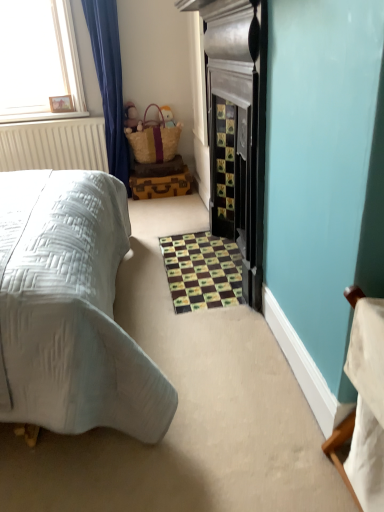
Question: Is woven straw basket at upper center turned away from matte brown wicker basket at upper center, arranged as the 2th toy when viewed from the left?

Choices:
 (A) no
 (B) yes

Answer: (B)

Question: Considering the relative positions of woven straw basket at upper center and matte brown wicker basket at upper center, arranged as the 2th toy when viewed from the left, in the image provided, is woven straw basket at upper center to the left of matte brown wicker basket at upper center, arranged as the 2th toy when viewed from the left, from the viewer's perspective?

Choices:
 (A) yes
 (B) no

Answer: (A)

Question: Could you tell me if woven straw basket at upper center is turned towards matte brown wicker basket at upper center, acting as the first toy starting from the right?

Choices:
 (A) yes
 (B) no

Answer: (B)

Question: Does woven straw basket at upper center have a lesser height compared to matte brown wicker basket at upper center, acting as the first toy starting from the right?

Choices:
 (A) yes
 (B) no

Answer: (B)

Question: From a real-world perspective, is woven straw basket at upper center located higher than matte brown wicker basket at upper center, acting as the first toy starting from the right?

Choices:
 (A) no
 (B) yes

Answer: (A)

Question: From the image's perspective, is woven straw basket at upper center located above or below brown mosaic tiles at center?

Choices:
 (A) above
 (B) below

Answer: (A)

Question: Is woven straw basket at upper center wider or thinner than brown mosaic tiles at center?

Choices:
 (A) wide
 (B) thin

Answer: (B)

Question: Considering the positions of woven straw basket at upper center and brown mosaic tiles at center in the image, is woven straw basket at upper center taller or shorter than brown mosaic tiles at center?

Choices:
 (A) short
 (B) tall

Answer: (B)

Question: Is point (140, 153) positioned closer to the camera than point (208, 260)?

Choices:
 (A) closer
 (B) farther

Answer: (B)

Question: Do you think woven straw basket at upper center is within matte brown plush toy at upper left, the second toy positioned from the right, or outside of it?

Choices:
 (A) outside
 (B) inside

Answer: (A)

Question: Relative to matte brown plush toy at upper left, which is counted as the 1th toy, starting from the left, is woven straw basket at upper center in front or behind?

Choices:
 (A) front
 (B) behind

Answer: (A)

Question: Is point (157, 111) closer or farther from the camera than point (129, 119)?

Choices:
 (A) farther
 (B) closer

Answer: (A)

Question: Visually, is woven straw basket at upper center positioned to the left or to the right of matte brown plush toy at upper left, which is counted as the 1th toy, starting from the left?

Choices:
 (A) right
 (B) left

Answer: (A)

Question: Would you say brown mosaic tiles at center is to the left or to the right of matte brown wicker basket at upper center, arranged as the 2th toy when viewed from the left, in the picture?

Choices:
 (A) left
 (B) right

Answer: (B)

Question: Relative to matte brown wicker basket at upper center, arranged as the 2th toy when viewed from the left, is brown mosaic tiles at center in front or behind?

Choices:
 (A) front
 (B) behind

Answer: (A)